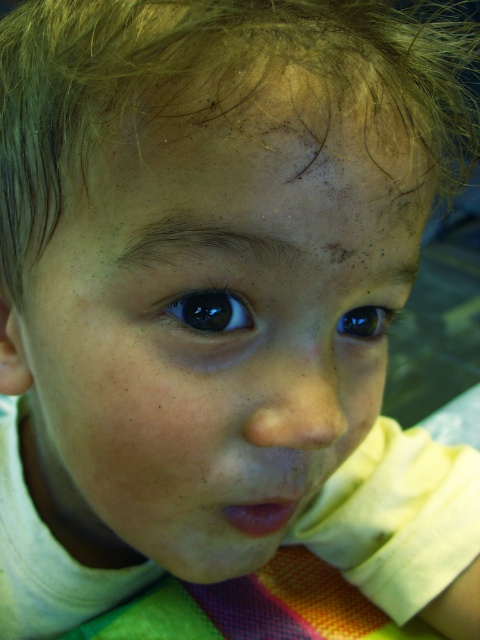
Is blonde fine hair at upper center positioned in front of glossy blue eye at center?

That is True.

Between point (45, 116) and point (170, 304), which one is positioned behind?

The point (45, 116) is behind.

This screenshot has height=640, width=480. Find the location of `blonde fine hair at upper center`. blonde fine hair at upper center is located at coordinates (211, 81).

Consider the image. Is smooth skin face at center below glossy blue eye at center?

Yes, smooth skin face at center is below glossy blue eye at center.

How far apart are smooth skin face at center and glossy blue eye at center?

3.13 inches

Locate an element on the screen. smooth skin face at center is located at coordinates click(212, 333).

Measure the distance between smooth skin face at center and camera.

A distance of 8.70 inches exists between smooth skin face at center and camera.

Is smooth skin face at center to the left of blonde fine hair at upper center from the viewer's perspective?

Indeed, smooth skin face at center is positioned on the left side of blonde fine hair at upper center.

This screenshot has width=480, height=640. In order to click on smooth skin face at center in this screenshot , I will do `click(212, 333)`.